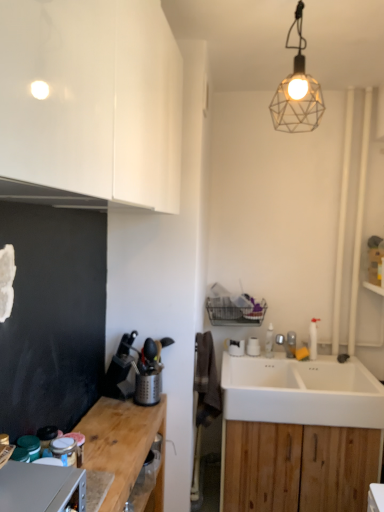
This screenshot has width=384, height=512. In order to click on free space in front of metallic grater at left, which appears as the third appliance when viewed from the front in this screenshot , I will do `click(129, 415)`.